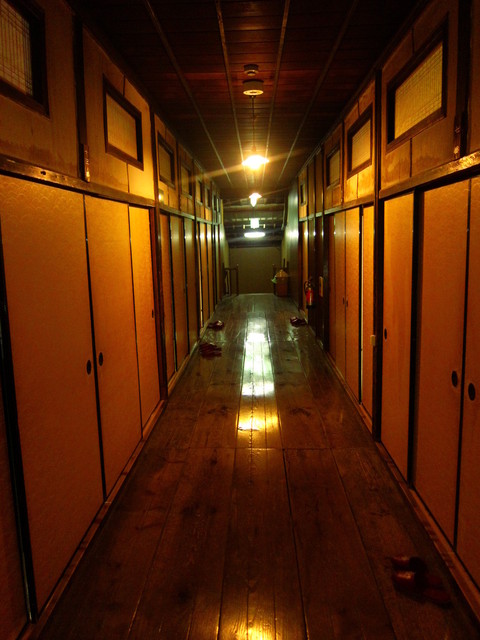
The width and height of the screenshot is (480, 640). What are the coordinates of `handle` in the screenshot? It's located at (89, 363), (102, 358), (454, 379), (469, 390), (385, 333), (154, 312), (347, 303), (342, 301).